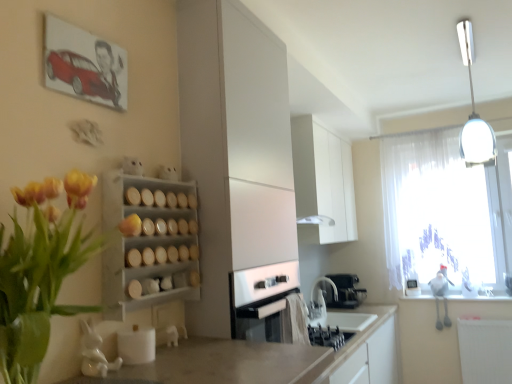
Identify the location of free space above white matte spice rack at center-left (from a real-world perspective). pos(158,176).